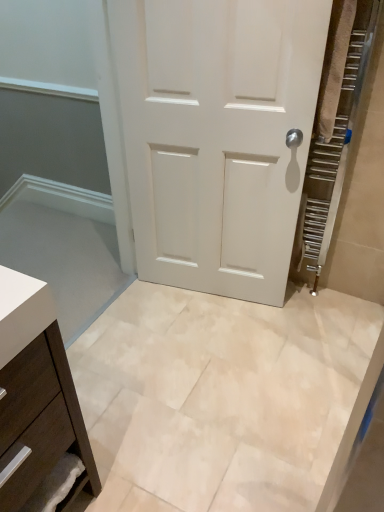
Image resolution: width=384 pixels, height=512 pixels. What are the coordinates of `vacant space situated above beige marble tile at center (from a real-world perspective)` in the screenshot? It's located at (216, 381).